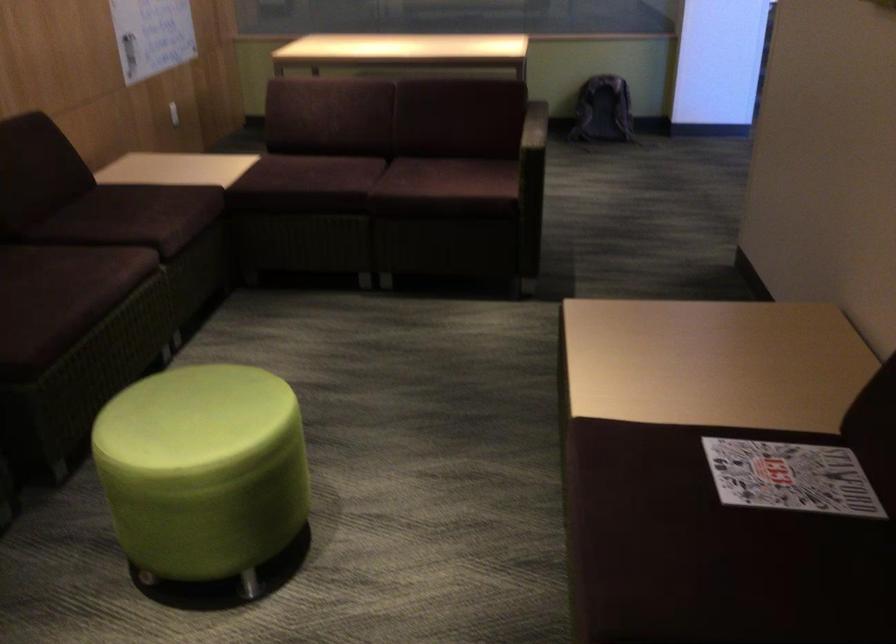
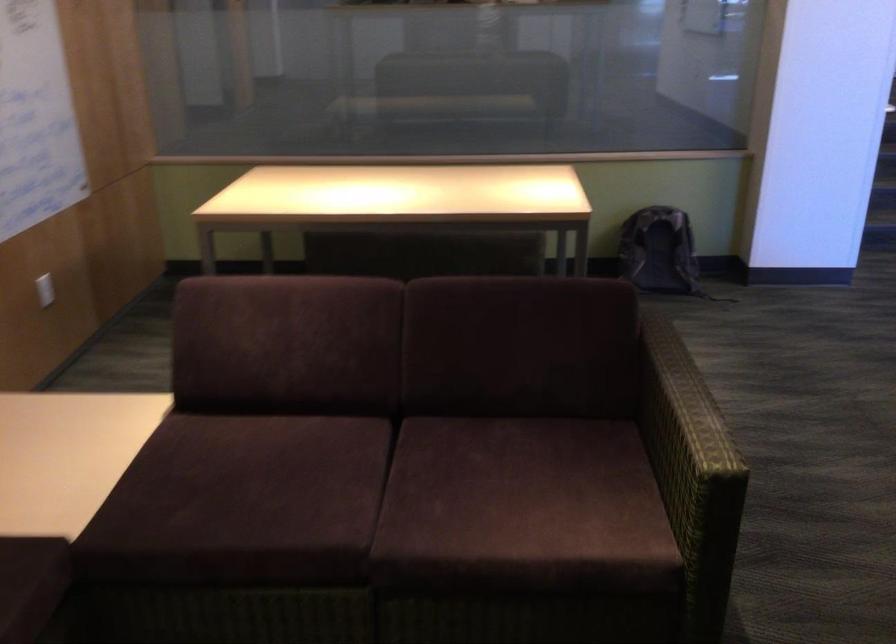
Where in the second image is the point corresponding to the point at 458,169 from the first image?

(526, 474)